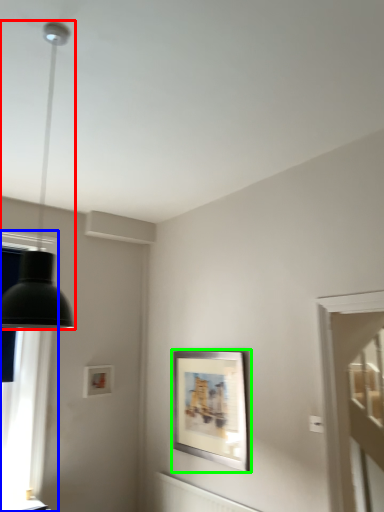
Question: Which object is positioned closest to lamp (highlighted by a red box)? Select from window (highlighted by a blue box) and picture frame (highlighted by a green box).

Choices:
 (A) window
 (B) picture frame

Answer: (A)